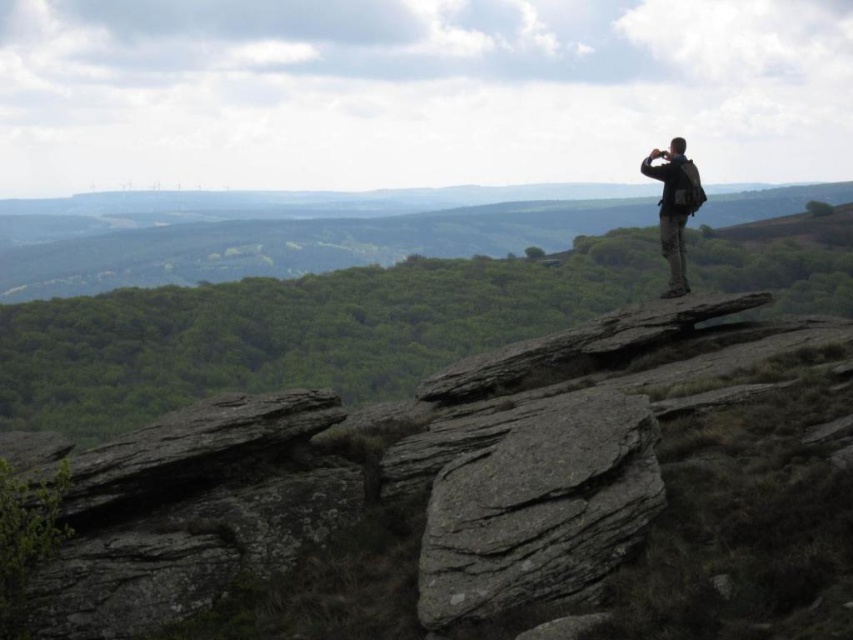
Question: Does gray/rocky stone at center have a larger size compared to camouflage fabric backpack at upper right?

Choices:
 (A) no
 (B) yes

Answer: (A)

Question: From the image, what is the correct spatial relationship of gray/rocky stone at center in relation to camouflage fabric backpack at upper right?

Choices:
 (A) left
 (B) right

Answer: (A)

Question: Which of the following is the farthest from the observer?

Choices:
 (A) (560, 465)
 (B) (665, 292)

Answer: (B)

Question: Observing the image, what is the correct spatial positioning of gray/rocky stone at center in reference to camouflage fabric backpack at upper right?

Choices:
 (A) left
 (B) right

Answer: (A)

Question: Which point appears closest to the camera in this image?

Choices:
 (A) (x=676, y=260)
 (B) (x=589, y=396)

Answer: (B)

Question: Among these points, which one is nearest to the camera?

Choices:
 (A) (585, 493)
 (B) (666, 296)

Answer: (A)